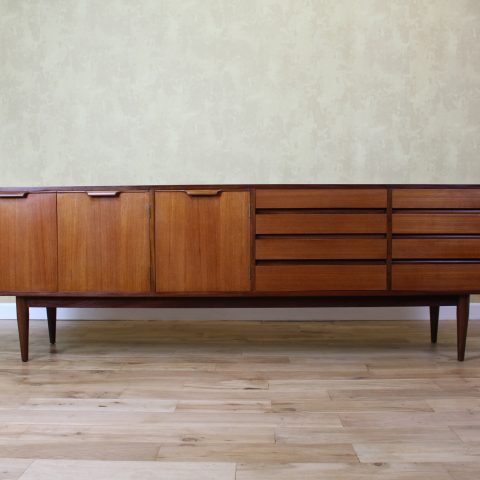
The height and width of the screenshot is (480, 480). I want to click on dark brown back cabinet legs, so click(x=52, y=325), click(x=434, y=326).